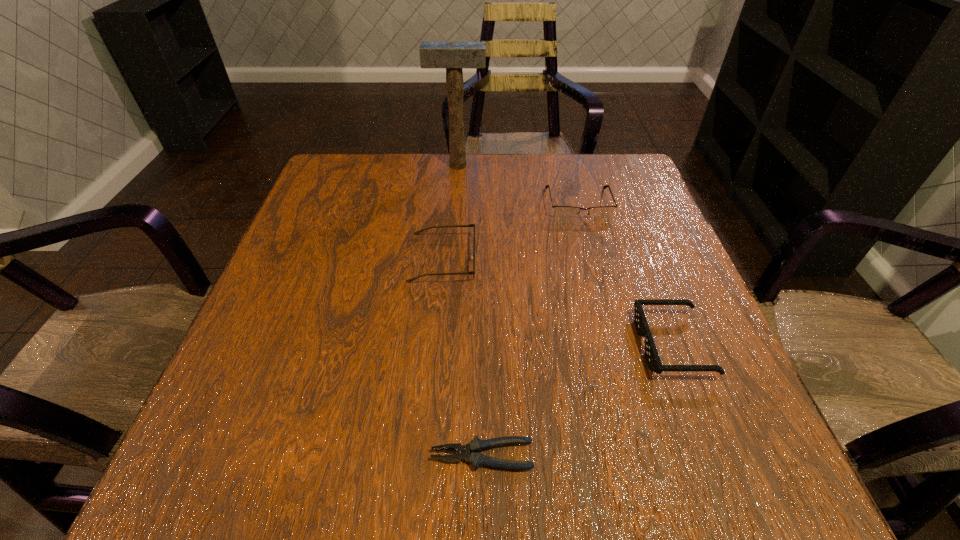
Identify the location of object present at the near edge. (476, 459).

The width and height of the screenshot is (960, 540). I want to click on spectacles that is positioned at the right edge, so click(562, 212).

This screenshot has height=540, width=960. I want to click on sunglasses at the right edge, so click(x=651, y=354).

I want to click on object located in the far right corner section of the desktop, so click(562, 212).

You are a GUI agent. You are given a task and a screenshot of the screen. Output one action in this format:
    pyautogui.click(x=<x>, y=<y>)
    Task: Click on the vacant space at the far edge of the desktop
    
    Given the screenshot: What is the action you would take?
    pyautogui.click(x=554, y=185)

Where is `vacant region at the left edge of the desktop`? This screenshot has height=540, width=960. vacant region at the left edge of the desktop is located at coordinates (308, 320).

Where is `vacant position at the right edge of the desktop`? vacant position at the right edge of the desktop is located at coordinates (716, 336).

You are a GUI agent. You are given a task and a screenshot of the screen. Output one action in this format:
    pyautogui.click(x=<x>, y=<y>)
    Task: Click on the free space at the far left corner
    The image size is (960, 540).
    Given the screenshot: What is the action you would take?
    pyautogui.click(x=335, y=174)

The height and width of the screenshot is (540, 960). Identify the location of vacant point at the near left corner. (286, 478).

Locate an element on the screen. This screenshot has height=540, width=960. vacant position at the far right corner of the desktop is located at coordinates [x=617, y=160].